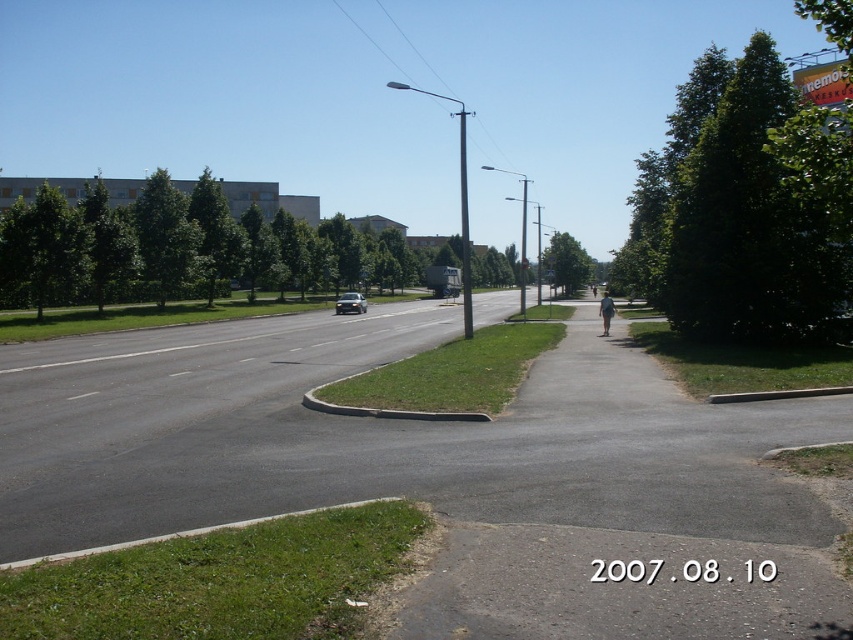
Question: Can you confirm if green leafy tree at right is positioned to the left of green leafy tree at center?

Choices:
 (A) yes
 (B) no

Answer: (B)

Question: Is green leafy tree at right positioned at the back of green leafy tree at center?

Choices:
 (A) no
 (B) yes

Answer: (A)

Question: Which of the following is the closest to the observer?

Choices:
 (A) green leafy tree at right
 (B) white plastic street sign at center
 (C) silver metallic car at center
 (D) green leafy tree at left

Answer: (A)

Question: Which object is positioned closest to the green leafy tree at center?

Choices:
 (A) green leafy tree at left
 (B) white plastic street sign at center

Answer: (B)

Question: Is green leafy tree at center in front of silver metallic car at center?

Choices:
 (A) yes
 (B) no

Answer: (B)

Question: Which point appears closest to the camera in this image?

Choices:
 (A) (457, 288)
 (B) (671, 232)
 (C) (338, 310)

Answer: (B)